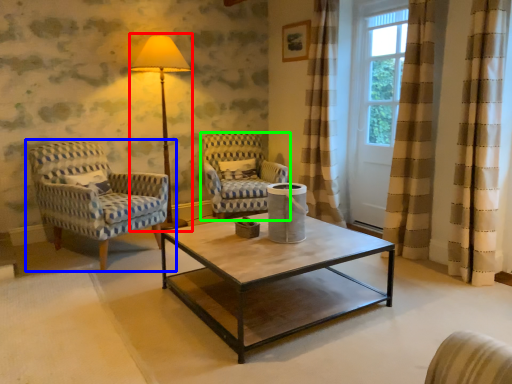
Question: Which is farther away from table lamp (highlighted by a red box)? chair (highlighted by a blue box) or chair (highlighted by a green box)?

Choices:
 (A) chair
 (B) chair

Answer: (A)